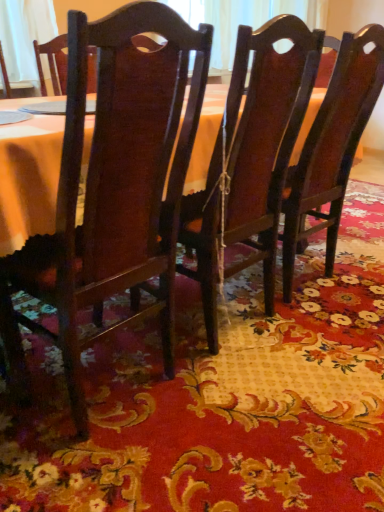
Question: From the image's perspective, does dark wood chair at center, which ranks as the 2th chair in right-to-left order, appear lower than glossy wood chair at center, the first chair in the right-to-left sequence?

Choices:
 (A) yes
 (B) no

Answer: (A)

Question: Is the position of dark wood chair at center, which is counted as the 2th chair, starting from the left, more distant than that of glossy wood chair at center, the first chair in the right-to-left sequence?

Choices:
 (A) no
 (B) yes

Answer: (A)

Question: Is dark wood chair at center, which is counted as the 2th chair, starting from the left, thinner than glossy wood chair at center, which is counted as the third chair, starting from the left?

Choices:
 (A) yes
 (B) no

Answer: (B)

Question: Considering the relative positions of dark wood chair at center, which ranks as the 2th chair in right-to-left order, and glossy wood chair at center, the first chair in the right-to-left sequence, in the image provided, is dark wood chair at center, which ranks as the 2th chair in right-to-left order, to the right of glossy wood chair at center, the first chair in the right-to-left sequence, from the viewer's perspective?

Choices:
 (A) yes
 (B) no

Answer: (B)

Question: Does dark wood chair at center, which is counted as the 2th chair, starting from the left, have a lesser height compared to glossy wood chair at center, the first chair in the right-to-left sequence?

Choices:
 (A) yes
 (B) no

Answer: (B)

Question: Considering the positions of dark wood chair at center, which ranks as the 2th chair in right-to-left order, and glossy wood chair at center, which is counted as the third chair, starting from the left, in the image, is dark wood chair at center, which ranks as the 2th chair in right-to-left order, wider or thinner than glossy wood chair at center, which is counted as the third chair, starting from the left,?

Choices:
 (A) thin
 (B) wide

Answer: (B)

Question: From the image's perspective, is dark wood chair at center, which is counted as the 2th chair, starting from the left, positioned above or below glossy wood chair at center, the first chair in the right-to-left sequence?

Choices:
 (A) below
 (B) above

Answer: (A)

Question: Is dark wood chair at center, which ranks as the 2th chair in right-to-left order, taller or shorter than glossy wood chair at center, which is counted as the third chair, starting from the left?

Choices:
 (A) short
 (B) tall

Answer: (B)

Question: From a real-world perspective, is dark wood chair at center, which ranks as the 2th chair in right-to-left order, positioned above or below glossy wood chair at center, the first chair in the right-to-left sequence?

Choices:
 (A) below
 (B) above

Answer: (A)

Question: Considering the positions of glossy wood chair at center, which is counted as the third chair, starting from the left, and floral-patterned fabric at center in the image, is glossy wood chair at center, which is counted as the third chair, starting from the left, taller or shorter than floral-patterned fabric at center?

Choices:
 (A) short
 (B) tall

Answer: (B)

Question: Which is correct: glossy wood chair at center, which is counted as the third chair, starting from the left, is inside floral-patterned fabric at center, or outside of it?

Choices:
 (A) outside
 (B) inside

Answer: (A)

Question: From a real-world perspective, is glossy wood chair at center, which is counted as the third chair, starting from the left, physically located above or below floral-patterned fabric at center?

Choices:
 (A) above
 (B) below

Answer: (A)

Question: In terms of width, does glossy wood chair at center, which is counted as the third chair, starting from the left, look wider or thinner when compared to floral-patterned fabric at center?

Choices:
 (A) thin
 (B) wide

Answer: (A)

Question: Would you say floral-patterned fabric at center is inside or outside glossy wood chair at center, the first chair in the right-to-left sequence?

Choices:
 (A) outside
 (B) inside

Answer: (A)

Question: Is floral-patterned fabric at center to the left or to the right of glossy wood chair at center, which is counted as the third chair, starting from the left, in the image?

Choices:
 (A) right
 (B) left

Answer: (A)